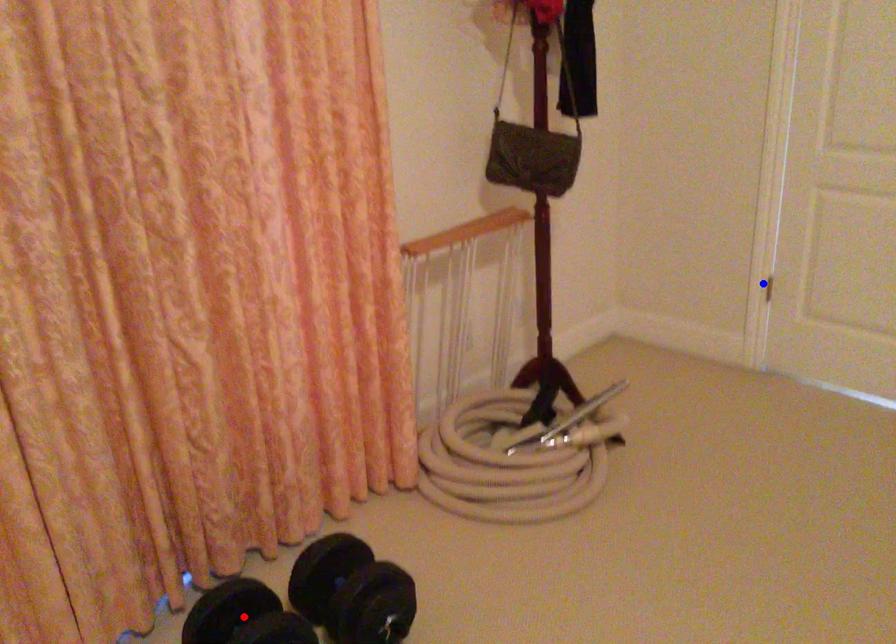
Question: In the image, two points are highlighted. Which point is nearer to the camera? Reply with the corresponding letter.

Choices:
 (A) blue point
 (B) red point

Answer: (B)